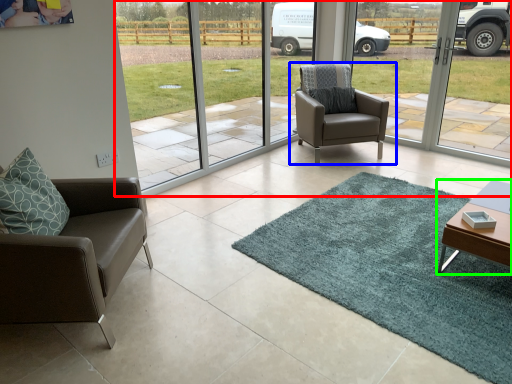
Question: Estimate the real-world distances between objects in this image. Which object is closer to window screen (highlighted by a red box), chair (highlighted by a blue box) or table (highlighted by a green box)?

Choices:
 (A) chair
 (B) table

Answer: (A)